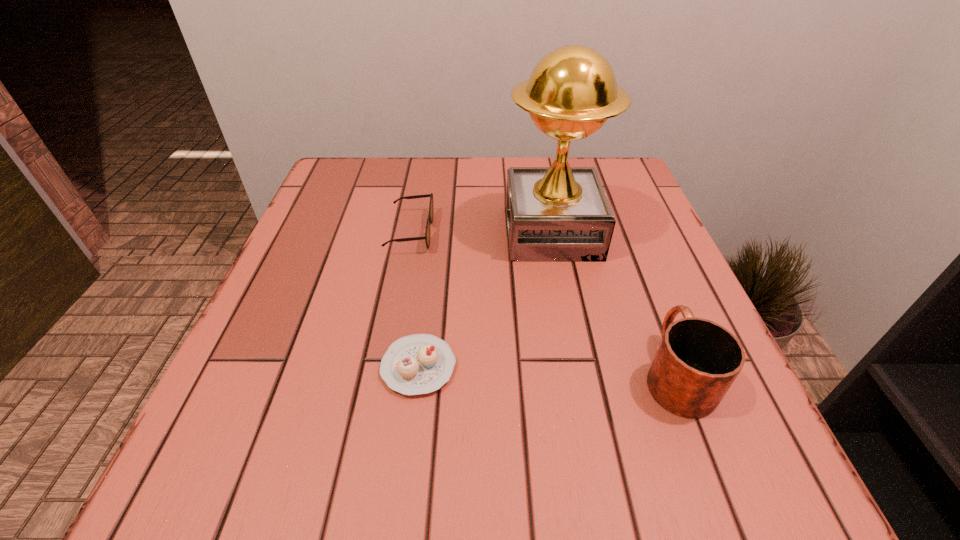
Where is `free space at the far left corner of the desktop`? The width and height of the screenshot is (960, 540). free space at the far left corner of the desktop is located at coordinates (344, 165).

Find the location of a particular element. The height and width of the screenshot is (540, 960). vacant space at the far right corner of the desktop is located at coordinates (632, 192).

I want to click on free space at the near right corner of the desktop, so (779, 473).

Find the location of a particular element. The width and height of the screenshot is (960, 540). vacant area that lies between the mug and the third tallest object is located at coordinates point(543,302).

The width and height of the screenshot is (960, 540). Identify the location of vacant area between the mug and the sunglasses. (543, 302).

Where is `free space between the second shortest object and the award`? free space between the second shortest object and the award is located at coordinates (481, 232).

At what (x,y) coordinates should I click in order to perform the action: click on free space between the tallest object and the cupcake. Please return your answer as a coordinate pair (x, y). The image size is (960, 540). Looking at the image, I should click on (486, 300).

This screenshot has width=960, height=540. What are the coordinates of `empty space between the sunglasses and the award` in the screenshot? It's located at (481, 232).

In order to click on vacant space in between the mug and the sunglasses in this screenshot , I will do pos(543,302).

You are a GUI agent. You are given a task and a screenshot of the screen. Output one action in this format:
    pyautogui.click(x=<x>, y=<y>)
    Task: Click on the free point between the cupcake and the second tallest object
    The image size is (960, 540).
    Given the screenshot: What is the action you would take?
    pyautogui.click(x=547, y=370)